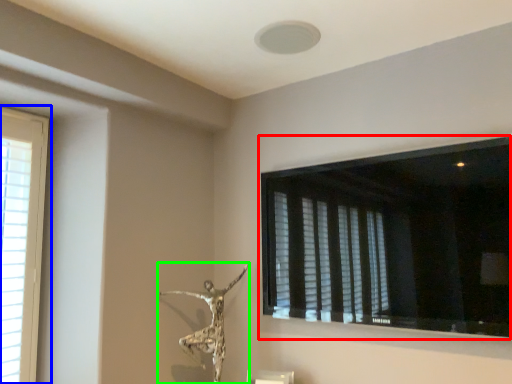
Question: Considering the real-world distances, which object is farthest from window (highlighted by a red box)? window (highlighted by a blue box) or sculpture (highlighted by a green box)?

Choices:
 (A) window
 (B) sculpture

Answer: (A)